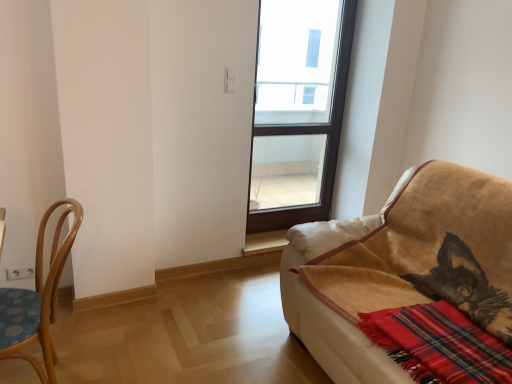
Question: Considering the relative sizes of light brown wood chair at left and red plaid blanket at lower right in the image provided, is light brown wood chair at left bigger than red plaid blanket at lower right?

Choices:
 (A) no
 (B) yes

Answer: (B)

Question: Considering the relative positions of light brown wood chair at left and red plaid blanket at lower right in the image provided, is light brown wood chair at left behind red plaid blanket at lower right?

Choices:
 (A) no
 (B) yes

Answer: (B)

Question: Could you tell me if light brown wood chair at left is turned towards red plaid blanket at lower right?

Choices:
 (A) no
 (B) yes

Answer: (A)

Question: From the image's perspective, is light brown wood chair at left over red plaid blanket at lower right?

Choices:
 (A) yes
 (B) no

Answer: (A)

Question: Can you confirm if light brown wood chair at left is wider than red plaid blanket at lower right?

Choices:
 (A) no
 (B) yes

Answer: (A)

Question: Considering the relative sizes of light brown wood chair at left and red plaid blanket at lower right in the image provided, is light brown wood chair at left thinner than red plaid blanket at lower right?

Choices:
 (A) no
 (B) yes

Answer: (B)

Question: Does velvet beige couch at right appear on the right side of transparent glass window at center?

Choices:
 (A) no
 (B) yes

Answer: (B)

Question: Does velvet beige couch at right lie in front of transparent glass window at center?

Choices:
 (A) yes
 (B) no

Answer: (A)

Question: From the image's perspective, would you say velvet beige couch at right is positioned over transparent glass window at center?

Choices:
 (A) no
 (B) yes

Answer: (A)

Question: From a real-world perspective, is velvet beige couch at right physically below transparent glass window at center?

Choices:
 (A) no
 (B) yes

Answer: (B)

Question: From a real-world perspective, is velvet beige couch at right over transparent glass window at center?

Choices:
 (A) yes
 (B) no

Answer: (B)

Question: Is velvet beige couch at right far away from transparent glass window at center?

Choices:
 (A) no
 (B) yes

Answer: (B)

Question: Does red plaid blanket at lower right appear on the right side of light brown wood chair at left?

Choices:
 (A) yes
 (B) no

Answer: (A)